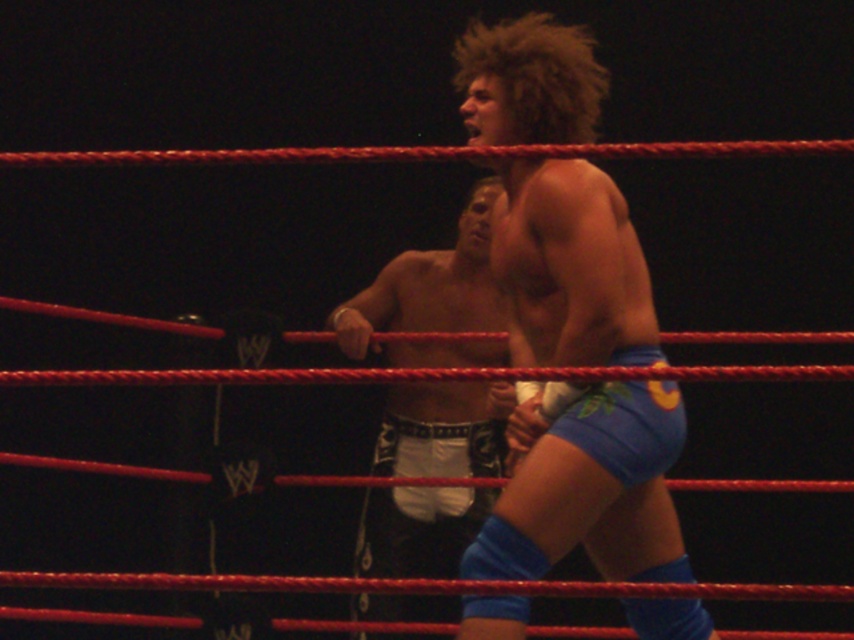
Question: Can you confirm if blue fabric shorts at center is wider than white fabric shorts at center?

Choices:
 (A) yes
 (B) no

Answer: (A)

Question: Which point appears closest to the camera in this image?

Choices:
 (A) (395, 513)
 (B) (512, 228)

Answer: (B)

Question: Does blue fabric shorts at center have a larger size compared to white fabric shorts at center?

Choices:
 (A) no
 (B) yes

Answer: (A)

Question: Is blue fabric shorts at center above white fabric shorts at center?

Choices:
 (A) no
 (B) yes

Answer: (B)

Question: Which point is closer to the camera?

Choices:
 (A) coord(576,307)
 (B) coord(443,529)

Answer: (A)